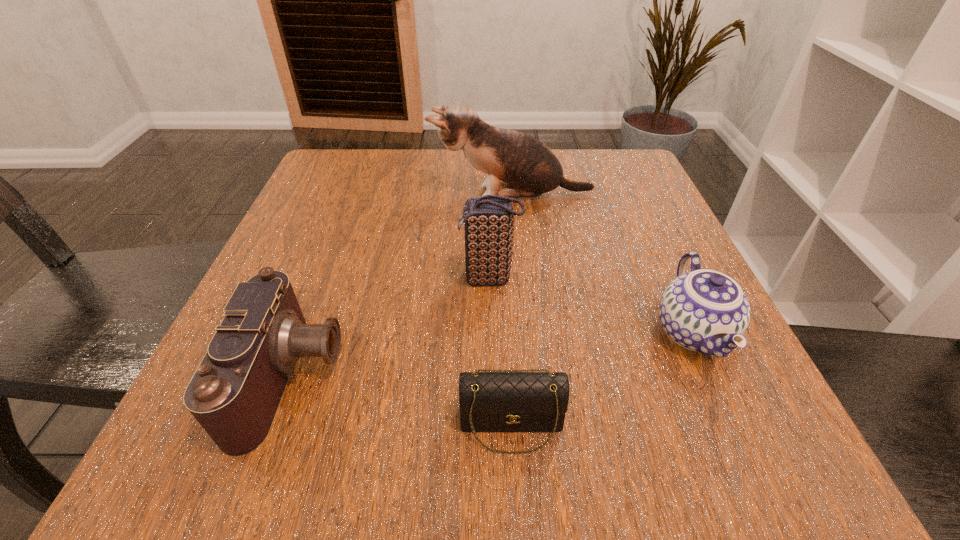
Where is `vacant area in the image that satisfies the following two spatial constraints: 1. at the spout of the rightmost object; 2. on the front-facing side of the leftmost object`? The width and height of the screenshot is (960, 540). vacant area in the image that satisfies the following two spatial constraints: 1. at the spout of the rightmost object; 2. on the front-facing side of the leftmost object is located at coordinates (713, 377).

Identify the location of vacant space that satisfies the following two spatial constraints: 1. at the spout of the rightmost object; 2. on the front-facing side of the camera. (713, 377).